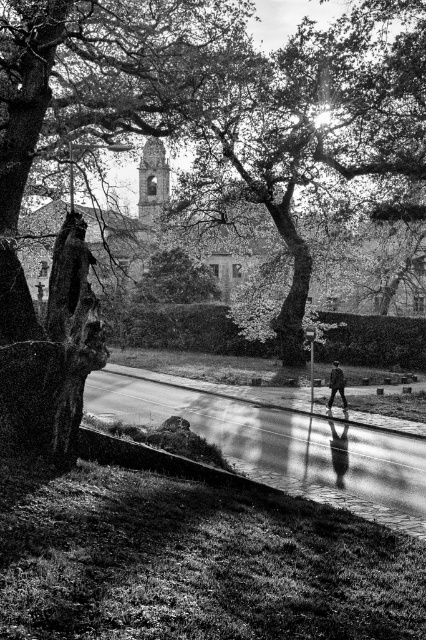
Is smooth bark tree at center wider than dark gray fabric jacket at center?

Indeed, smooth bark tree at center has a greater width compared to dark gray fabric jacket at center.

Which is more to the left, smooth bark tree at center or dark gray fabric jacket at center?

From the viewer's perspective, smooth bark tree at center appears more on the left side.

Describe the element at coordinates (100, 147) in the screenshot. This screenshot has height=640, width=426. I see `smooth bark tree at center` at that location.

Locate an element on the screen. Image resolution: width=426 pixels, height=640 pixels. smooth bark tree at center is located at coordinates (100, 147).

Is smooth bark tree at upper center smaller than dark gray fabric jacket at center?

Actually, smooth bark tree at upper center might be larger than dark gray fabric jacket at center.

Is smooth bark tree at upper center taller than dark gray fabric jacket at center?

Yes.

The width and height of the screenshot is (426, 640). What do you see at coordinates (310, 128) in the screenshot?
I see `smooth bark tree at upper center` at bounding box center [310, 128].

Locate an element on the screen. smooth bark tree at upper center is located at coordinates (310, 128).

Who is lower down, smooth bark tree at upper center or smooth asphalt pavement at center?

smooth asphalt pavement at center is lower down.

Does smooth bark tree at upper center have a larger size compared to smooth asphalt pavement at center?

Yes, smooth bark tree at upper center is bigger than smooth asphalt pavement at center.

Measure the distance between point (232, 68) and camera.

They are 89.02 feet apart.

You are a GUI agent. You are given a task and a screenshot of the screen. Output one action in this format:
    pyautogui.click(x=<x>, y=<y>)
    Task: Click on the smooth bark tree at upper center
    
    Given the screenshot: What is the action you would take?
    pyautogui.click(x=310, y=128)